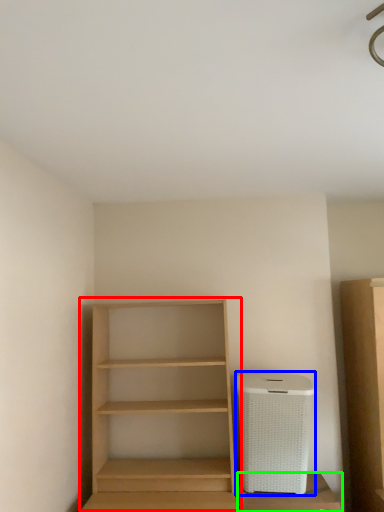
Question: Which is nearer to the shelf (highlighted by a red box)? appliance (highlighted by a blue box) or cabinetry (highlighted by a green box).

Choices:
 (A) appliance
 (B) cabinetry

Answer: (A)